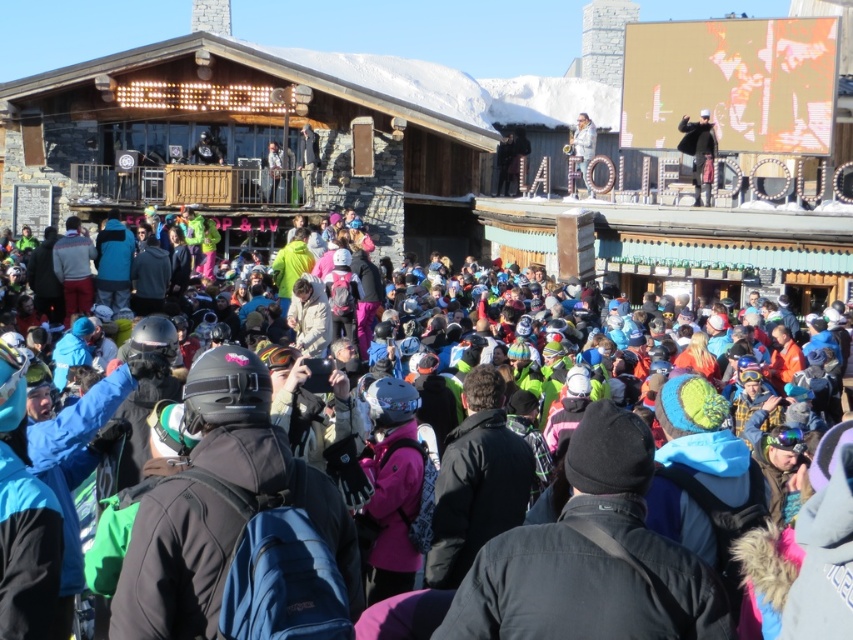
Measure the distance between point (508, 250) and camera.

95.23 meters

Can you confirm if wooden ski resort at center is positioned above black leather jacket at upper right?

Indeed, wooden ski resort at center is positioned over black leather jacket at upper right.

Image resolution: width=853 pixels, height=640 pixels. What are the coordinates of `wooden ski resort at center` in the screenshot? It's located at click(447, 154).

Who is lower down, black leather jacket at upper right or light brown wooden sign at upper center?

black leather jacket at upper right is lower down.

Does black leather jacket at upper right lie in front of light brown wooden sign at upper center?

Yes.

Is point (694, 154) farther from camera compared to point (583, 163)?

No, (694, 154) is in front of (583, 163).

The width and height of the screenshot is (853, 640). I want to click on black leather jacket at upper right, so (699, 152).

Is multicolored fabric crowd at center taller than light brown wooden sign at upper center?

Yes, multicolored fabric crowd at center is taller than light brown wooden sign at upper center.

Image resolution: width=853 pixels, height=640 pixels. What are the coordinates of `multicolored fabric crowd at center` in the screenshot? It's located at (563, 356).

Locate an element on the screen. The image size is (853, 640). multicolored fabric crowd at center is located at coordinates (563, 356).